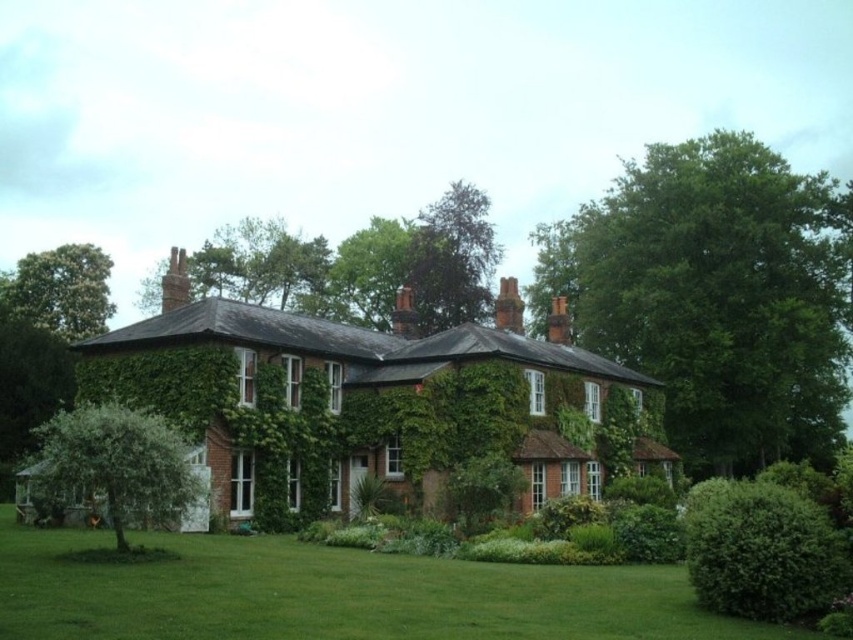
Does green grass at lower center appear on the right side of brown brick chimney at center?

Incorrect, green grass at lower center is not on the right side of brown brick chimney at center.

Can you confirm if green grass at lower center is positioned to the left of brown brick chimney at center?

Yes, green grass at lower center is to the left of brown brick chimney at center.

Between point (647, 605) and point (515, 332), which one is positioned in front?

Point (647, 605) is in front.

At what (x,y) coordinates should I click in order to perform the action: click on green grass at lower center. Please return your answer as a coordinate pair (x, y). Looking at the image, I should click on (334, 595).

Between green leafy tree at upper right and smooth brick chimney at upper left, which one has more height?

With more height is green leafy tree at upper right.

Is green leafy tree at upper right in front of smooth brick chimney at upper left?

No, green leafy tree at upper right is behind smooth brick chimney at upper left.

Measure the distance between point (636, 180) and camera.

130.24 meters

At what (x,y) coordinates should I click in order to perform the action: click on green leafy tree at upper right. Please return your answer as a coordinate pair (x, y). This screenshot has height=640, width=853. Looking at the image, I should click on (715, 296).

Is point (178, 289) closer to camera compared to point (508, 323)?

Yes, it is.

Is point (173, 300) closer to camera compared to point (502, 300)?

Yes, point (173, 300) is in front of point (502, 300).

Where is `smooth brick chimney at upper left`? smooth brick chimney at upper left is located at coordinates (175, 282).